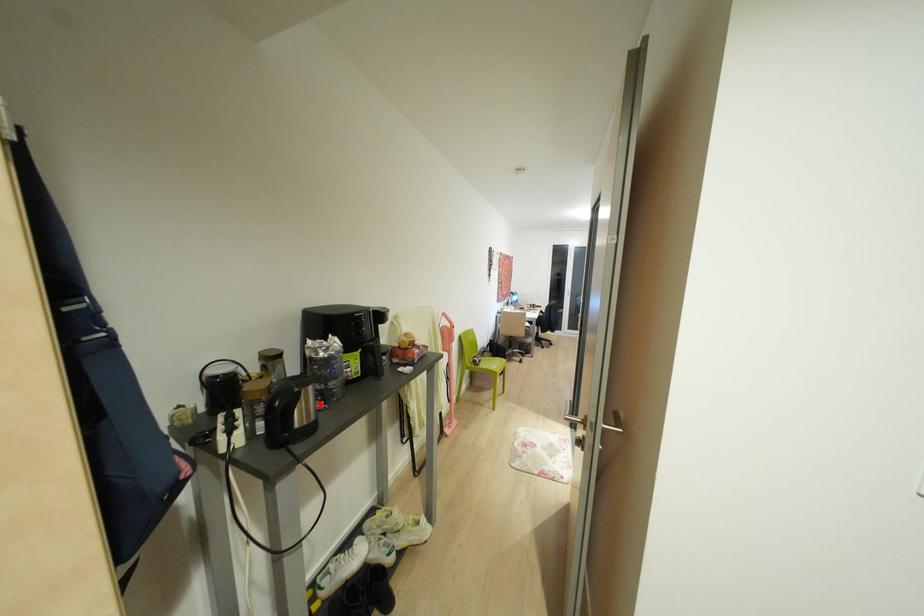
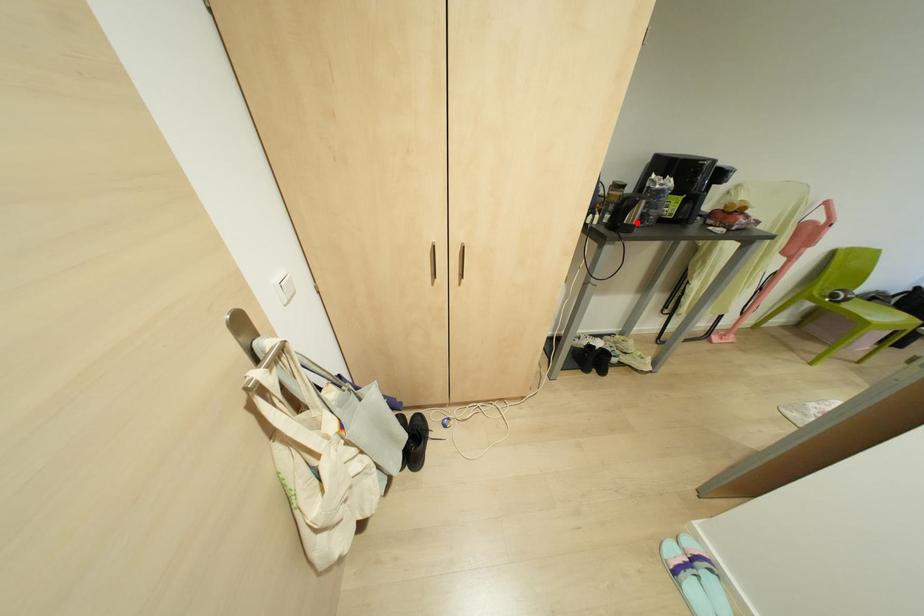
I am providing you with two images of the same scene from different viewpoints. A red point is marked on the first image and another point is marked on the second image. Does the point marked in image1 correspond to the same location as the one in image2?

Yes